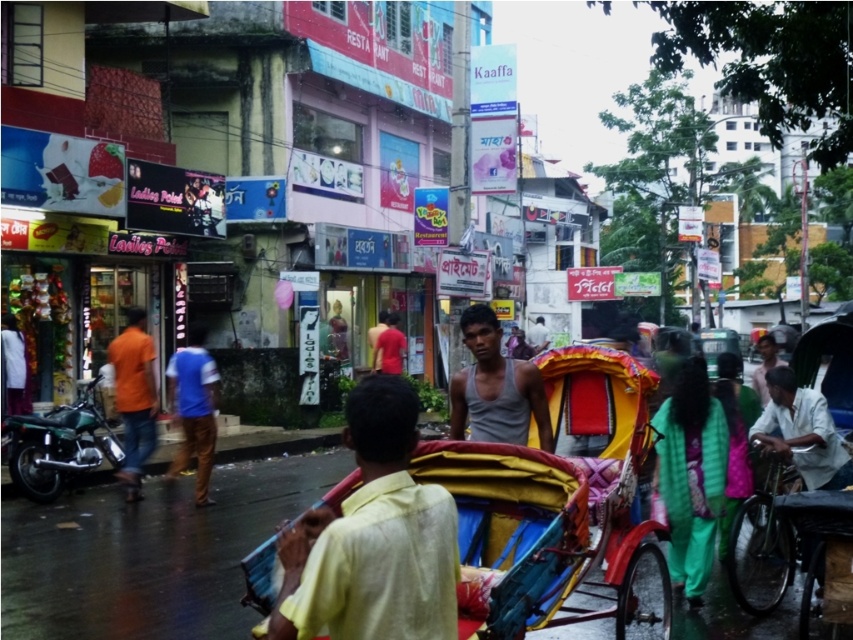
From the picture: You are a photographer trying to capture both the orange cotton shirt at left and the gray cotton shirt at center in a single frame. Which shirt should you focus on first to ensure both are in the frame?

The orange cotton shirt at left is smaller than the gray cotton shirt at center, so you should focus on the gray cotton shirt at center first to ensure both are in the frame.

You are a photographer standing in the street scene. You want to take a photo of both the orange cotton shirt at left and the gray cotton shirt at center. Which shirt should you focus on first if you want to capture both in the frame without moving the camera?

Since the orange cotton shirt at left is narrower than the gray cotton shirt at center, you should focus on the orange cotton shirt at left first to ensure it fits within the frame before the wider gray cotton shirt at center might cause framing issues.

Consider the image. You are standing at the point labeled point (514, 401) and want to walk to the point labeled point (799, 448). Which direction should you move in relation to the scene?

You should move backward because point (514, 401) is in front of point (799, 448).